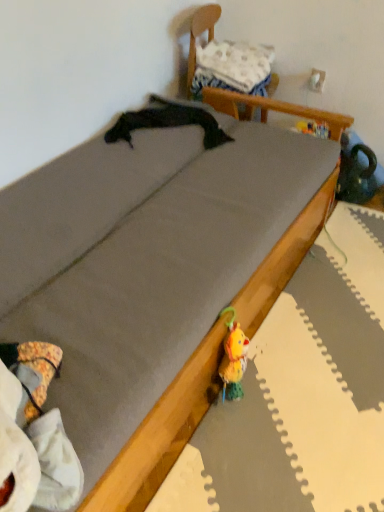
Question: Should I look upward or downward to see white fabric pillow at upper center?

Choices:
 (A) down
 (B) up

Answer: (B)

Question: From a real-world perspective, is wooden chair at upper center physically below white fabric pillow at upper center?

Choices:
 (A) yes
 (B) no

Answer: (A)

Question: Does wooden chair at upper center turn towards white fabric pillow at upper center?

Choices:
 (A) no
 (B) yes

Answer: (B)

Question: Can you confirm if wooden chair at upper center is positioned to the left of white fabric pillow at upper center?

Choices:
 (A) no
 (B) yes

Answer: (A)

Question: From the image's perspective, is wooden chair at upper center under white fabric pillow at upper center?

Choices:
 (A) yes
 (B) no

Answer: (A)

Question: Is wooden chair at upper center bigger than white fabric pillow at upper center?

Choices:
 (A) yes
 (B) no

Answer: (A)

Question: Would you say wooden chair at upper center is a long distance from white fabric pillow at upper center?

Choices:
 (A) yes
 (B) no

Answer: (B)

Question: From a real-world perspective, is white fabric pillow at upper center on top of wooden chair at upper center?

Choices:
 (A) yes
 (B) no

Answer: (A)

Question: Can you confirm if white fabric pillow at upper center is bigger than wooden chair at upper center?

Choices:
 (A) yes
 (B) no

Answer: (B)

Question: Is white fabric pillow at upper center at the right side of wooden chair at upper center?

Choices:
 (A) no
 (B) yes

Answer: (A)

Question: Is white fabric pillow at upper center positioned far away from wooden chair at upper center?

Choices:
 (A) no
 (B) yes

Answer: (A)

Question: Is white fabric pillow at upper center thinner than wooden chair at upper center?

Choices:
 (A) no
 (B) yes

Answer: (B)

Question: Can you confirm if white fabric pillow at upper center is positioned to the left of wooden chair at upper center?

Choices:
 (A) no
 (B) yes

Answer: (B)

Question: Is white fabric pillow at upper center taller or shorter than wooden chair at upper center?

Choices:
 (A) tall
 (B) short

Answer: (B)